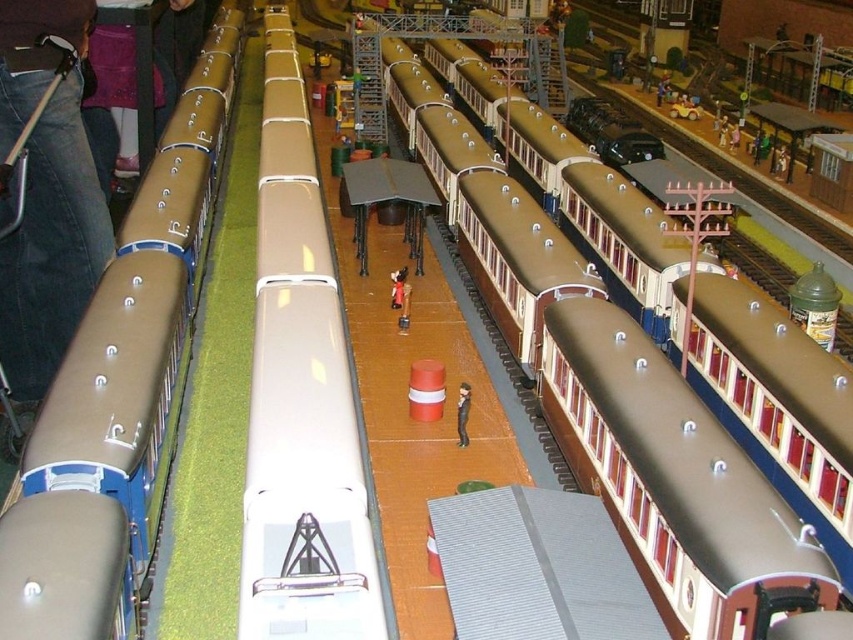
You are a small toy that is 10 cm tall. You want to hide behind either the matte brown train car at left or the smooth black figure at center. Which object would allow you to be completely hidden from view?

The matte brown train car at left is taller than the smooth black figure at center, so hiding behind the matte brown train car at left would allow you to be completely hidden since it is taller than the toy.

You are a small toy figure standing on the platform at the model train station. You see the brown matte train at center and the smooth black figure at center. Which object is positioned higher in elevation compared to the other?

The brown matte train at center is located above the smooth black figure at center, so it has a higher elevation.